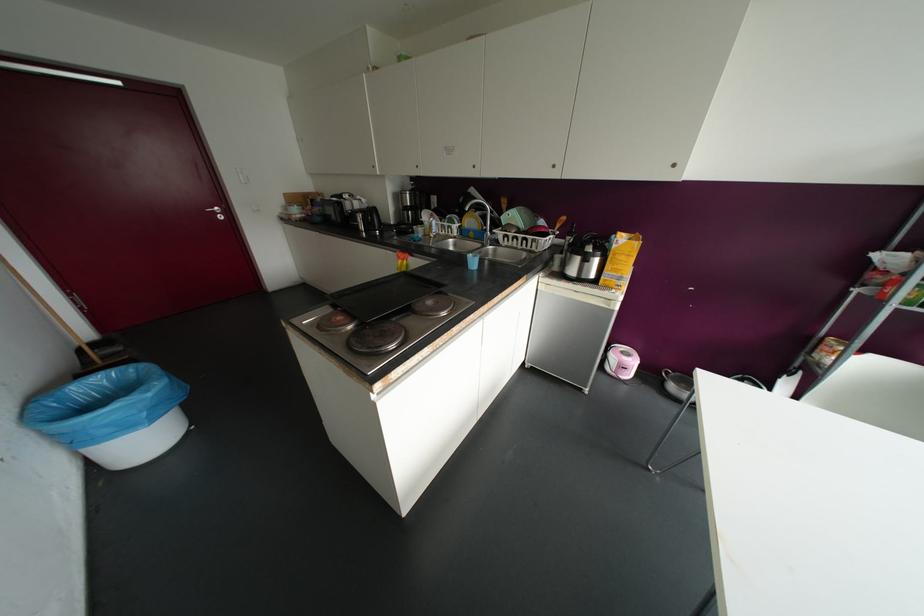
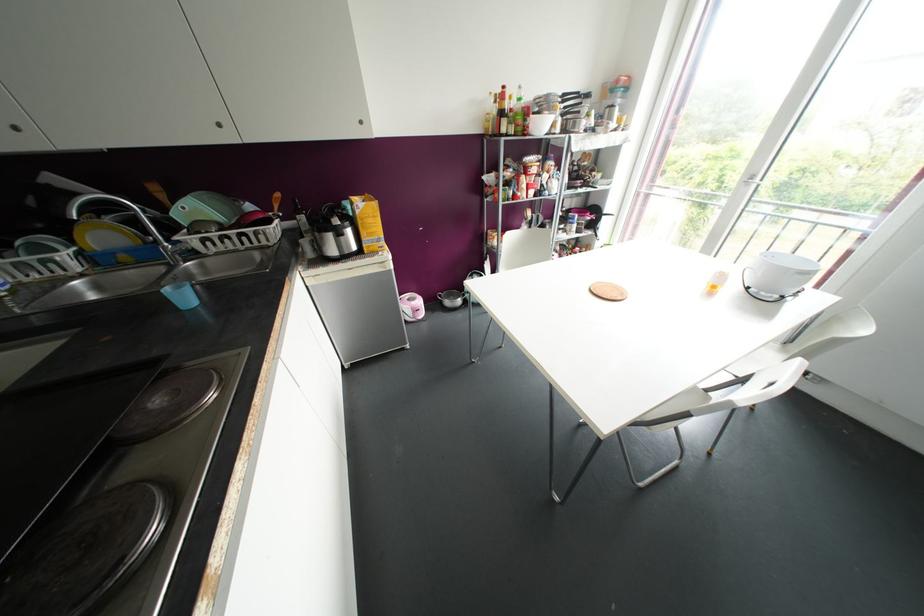
In the second image, find the point that corresponds to (472,262) in the first image.

(184, 297)